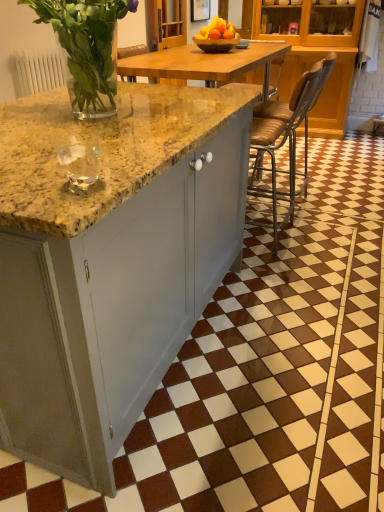
Question: From the image's perspective, is wooden bowl at center on top of matte gray cabinet at center?

Choices:
 (A) no
 (B) yes

Answer: (B)

Question: From the image's perspective, is wooden bowl at center under matte gray cabinet at center?

Choices:
 (A) no
 (B) yes

Answer: (A)

Question: From a real-world perspective, does wooden bowl at center stand above matte gray cabinet at center?

Choices:
 (A) no
 (B) yes

Answer: (B)

Question: Considering the relative sizes of wooden bowl at center and matte gray cabinet at center in the image provided, is wooden bowl at center smaller than matte gray cabinet at center?

Choices:
 (A) yes
 (B) no

Answer: (A)

Question: Is wooden bowl at center at the right side of matte gray cabinet at center?

Choices:
 (A) yes
 (B) no

Answer: (B)

Question: Does wooden bowl at center come behind matte gray cabinet at center?

Choices:
 (A) yes
 (B) no

Answer: (A)

Question: Can you confirm if clear glass vase at upper left is shorter than metallic brown bar stool at center?

Choices:
 (A) yes
 (B) no

Answer: (A)

Question: Does clear glass vase at upper left have a smaller size compared to metallic brown bar stool at center?

Choices:
 (A) yes
 (B) no

Answer: (A)

Question: Is the depth of clear glass vase at upper left less than that of metallic brown bar stool at center?

Choices:
 (A) no
 (B) yes

Answer: (B)

Question: Is clear glass vase at upper left at the right side of metallic brown bar stool at center?

Choices:
 (A) no
 (B) yes

Answer: (A)

Question: From a real-world perspective, does clear glass vase at upper left sit lower than metallic brown bar stool at center?

Choices:
 (A) no
 (B) yes

Answer: (A)

Question: Is clear glass vase at upper left to the left of metallic brown bar stool at center from the viewer's perspective?

Choices:
 (A) no
 (B) yes

Answer: (B)

Question: Is metallic brown bar stool at center beside wooden bowl at center?

Choices:
 (A) yes
 (B) no

Answer: (B)